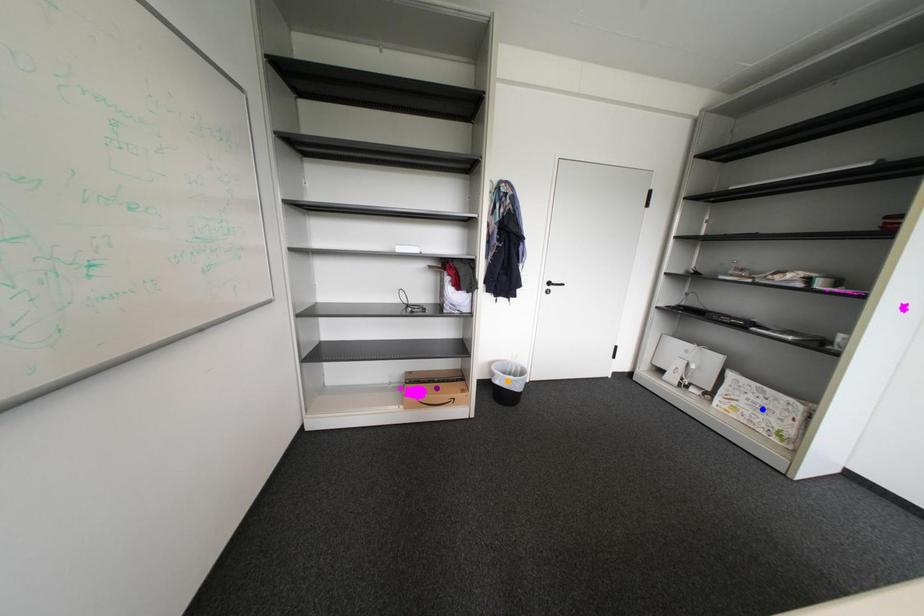
From the picture: Order these from nearest to farthest:
1. purple point
2. blue point
3. orange point

blue point
purple point
orange point